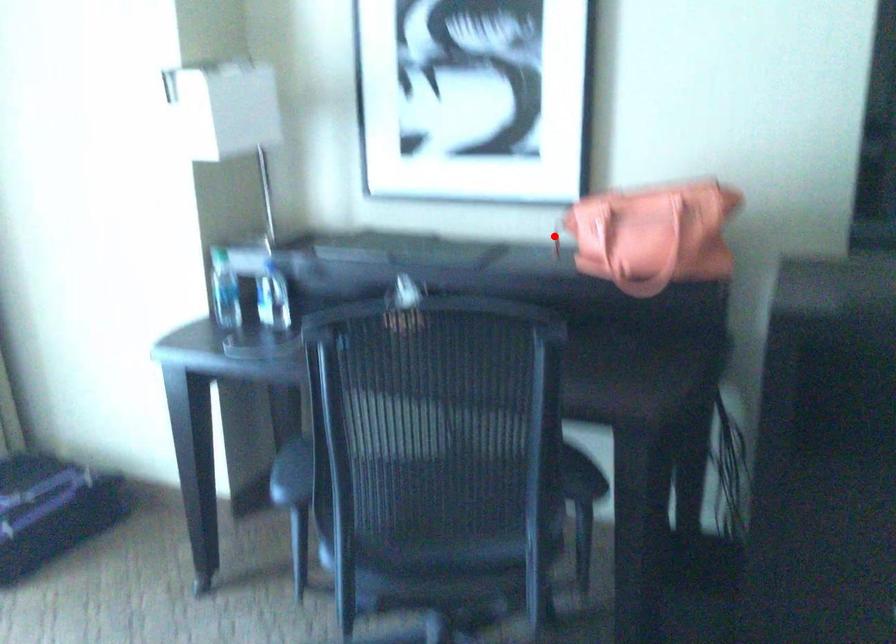
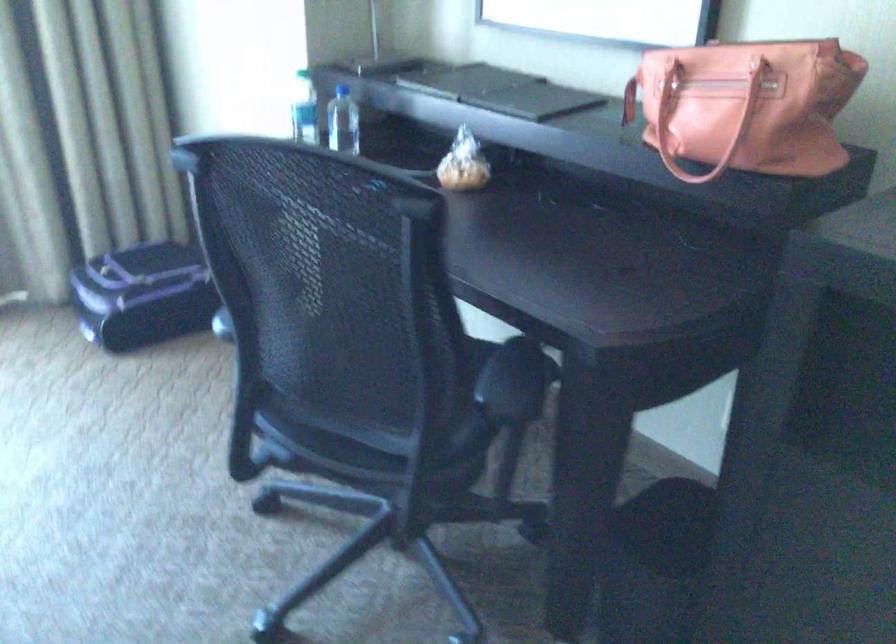
Find the pixel in the second image that matches the highlighted location in the first image.

(629, 100)